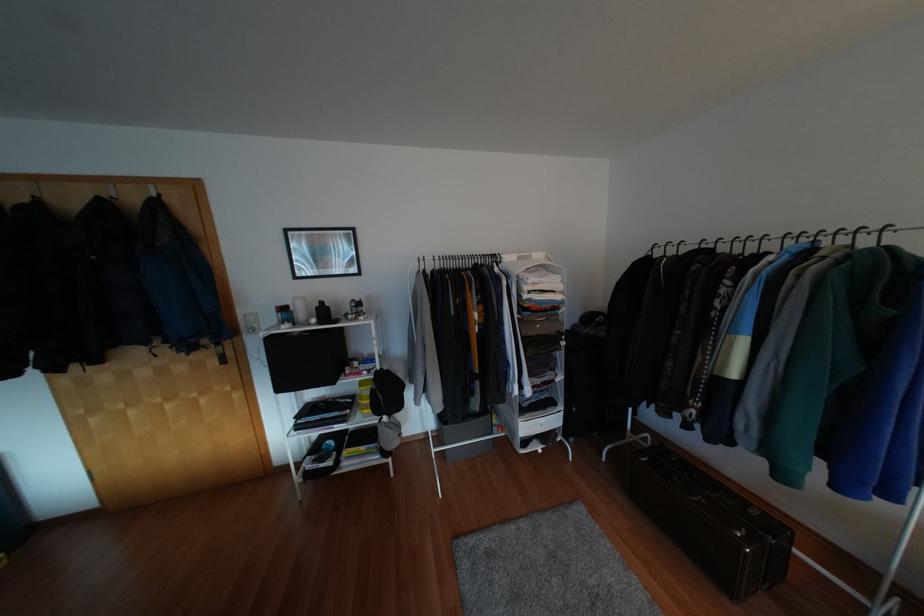
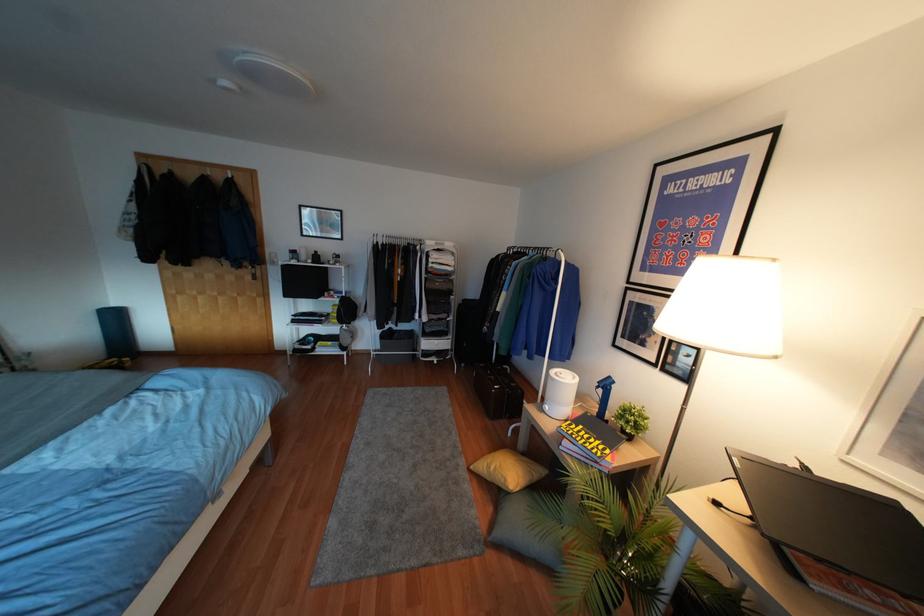
What movement of the cameraman would produce the second image?

The movement direction of the cameraman is right, backward.